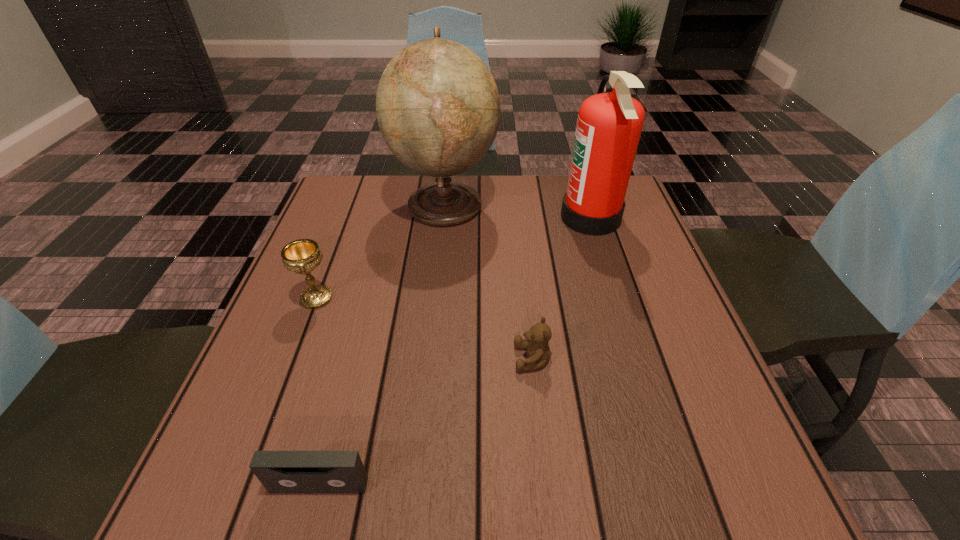
The image size is (960, 540). Find the location of `vacant region located at the nozzle of the fire extinguisher`. vacant region located at the nozzle of the fire extinguisher is located at coordinates (436, 218).

This screenshot has height=540, width=960. What are the coordinates of `vacant space located 0.050m on the front of the leftmost object` in the screenshot? It's located at (304, 330).

The width and height of the screenshot is (960, 540). Identify the location of vacant space located 0.260m on the front-facing side of the second object from right to left. (375, 359).

At what (x,y) coordinates should I click in order to perform the action: click on vacant position located 0.250m on the front-facing side of the second object from right to left. Please return your answer as a coordinate pair (x, y). Image resolution: width=960 pixels, height=540 pixels. Looking at the image, I should click on (381, 359).

Where is `free space located 0.280m on the front-facing side of the second object from right to left`? The width and height of the screenshot is (960, 540). free space located 0.280m on the front-facing side of the second object from right to left is located at coordinates (365, 359).

The image size is (960, 540). Find the location of `globe located in the far edge section of the desktop`. globe located in the far edge section of the desktop is located at coordinates (438, 109).

Image resolution: width=960 pixels, height=540 pixels. In order to click on fire extinguisher that is at the far edge in this screenshot , I will do `click(609, 125)`.

You are a GUI agent. You are given a task and a screenshot of the screen. Output one action in this format:
    pyautogui.click(x=<x>, y=<y>)
    Task: Click on the object that is at the near edge
    Image resolution: width=960 pixels, height=540 pixels.
    Given the screenshot: What is the action you would take?
    pyautogui.click(x=279, y=471)

This screenshot has width=960, height=540. Identify the location of chalice situated at the left edge. (302, 256).

Where is `videotape located at the left edge`? This screenshot has height=540, width=960. videotape located at the left edge is located at coordinates (279, 471).